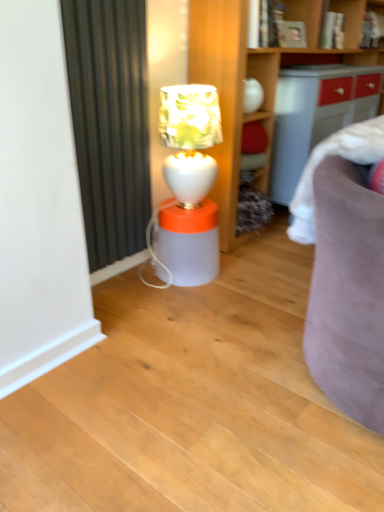
Question: Does white glossy table lamp at center have a greater width compared to translucent plastic lamp at center?

Choices:
 (A) yes
 (B) no

Answer: (B)

Question: Is white glossy table lamp at center to the right of translucent plastic lamp at center from the viewer's perspective?

Choices:
 (A) no
 (B) yes

Answer: (B)

Question: Does white glossy table lamp at center have a smaller size compared to translucent plastic lamp at center?

Choices:
 (A) no
 (B) yes

Answer: (A)

Question: Is white glossy table lamp at center shorter than translucent plastic lamp at center?

Choices:
 (A) no
 (B) yes

Answer: (A)

Question: From a real-world perspective, is white glossy table lamp at center positioned under translucent plastic lamp at center based on gravity?

Choices:
 (A) yes
 (B) no

Answer: (B)

Question: Is white glossy table lamp at center facing away from translucent plastic lamp at center?

Choices:
 (A) no
 (B) yes

Answer: (A)

Question: Considering the relative sizes of translucent plastic lamp at center and white glossy table lamp at center in the image provided, is translucent plastic lamp at center shorter than white glossy table lamp at center?

Choices:
 (A) yes
 (B) no

Answer: (A)

Question: Does translucent plastic lamp at center turn towards white glossy table lamp at center?

Choices:
 (A) yes
 (B) no

Answer: (B)

Question: Considering the relative positions of translucent plastic lamp at center and white glossy table lamp at center in the image provided, is translucent plastic lamp at center to the left of white glossy table lamp at center from the viewer's perspective?

Choices:
 (A) yes
 (B) no

Answer: (A)

Question: From a real-world perspective, is translucent plastic lamp at center positioned under white glossy table lamp at center based on gravity?

Choices:
 (A) no
 (B) yes

Answer: (B)

Question: Considering the relative positions of translucent plastic lamp at center and white glossy table lamp at center in the image provided, is translucent plastic lamp at center to the right of white glossy table lamp at center from the viewer's perspective?

Choices:
 (A) no
 (B) yes

Answer: (A)

Question: From the image's perspective, is translucent plastic lamp at center on white glossy table lamp at center?

Choices:
 (A) no
 (B) yes

Answer: (A)

Question: Considering the positions of white glossy table lamp at center and translucent plastic lamp at center in the image, is white glossy table lamp at center wider or thinner than translucent plastic lamp at center?

Choices:
 (A) wide
 (B) thin

Answer: (B)